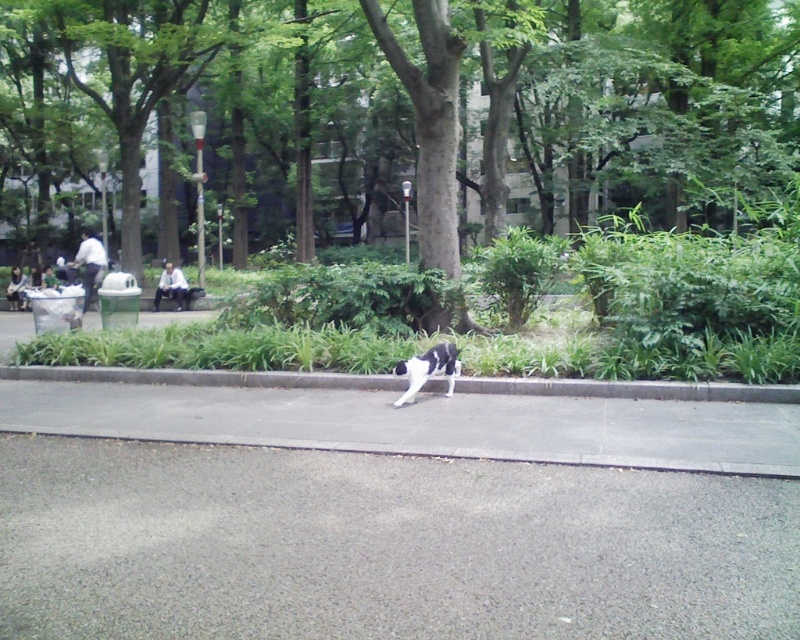
You are standing at the point marked by the coordinates point (202, 378) in the park scene. Which object are you standing on?

You are standing on the gray concrete curb at lower center, which is represented by point (202, 378).

You are standing at point (x=680, y=588) and want to walk to point (x=10, y=83). Which direction should you move relative to the black and white dog currently facing the right side of the frame?

You should move to the left relative to the black and white dog currently facing the right side of the frame because point (x=10, y=83) is behind point (x=680, y=588).

You are a gardener planning to plant a new tree in the park. You need to ensure it doesn not block the pathway. Based on the scene, which object is wider, the green leafy tree at center or the gray asphalt pavement at lower center?

The green leafy tree at center might be wider than the gray asphalt pavement at lower center according to the description.